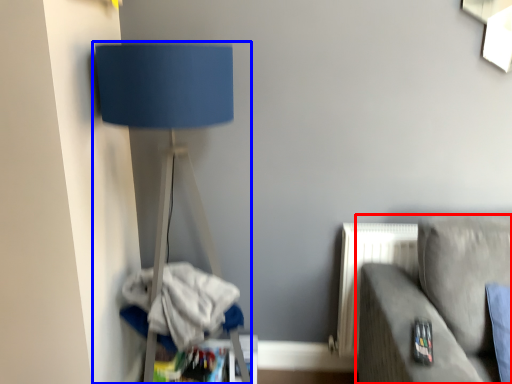
Question: Which of the following is the closest to the observer, studio couch (highlighted by a red box) or lamp (highlighted by a blue box)?

Choices:
 (A) studio couch
 (B) lamp

Answer: (A)